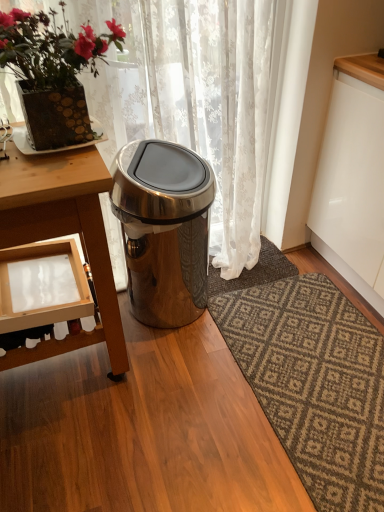
Where is `vacant region in front of wooden table at left`? This screenshot has height=512, width=384. vacant region in front of wooden table at left is located at coordinates (85, 456).